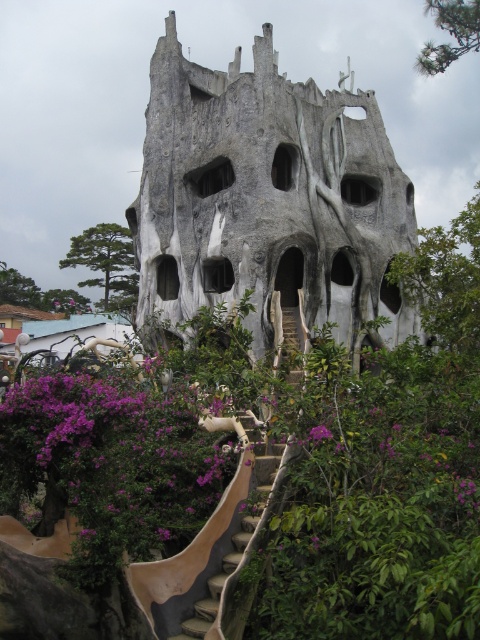
Can you confirm if purple matte flower at lower left is smaller than purple matte flower at center?

Incorrect, purple matte flower at lower left is not smaller in size than purple matte flower at center.

Between purple matte flower at lower left and purple matte flower at center, which one appears on the left side from the viewer's perspective?

purple matte flower at lower left is more to the left.

Who is more distant from viewer, (25, 438) or (310, 432)?

Positioned behind is point (310, 432).

Locate an element on the screen. purple matte flower at lower left is located at coordinates (109, 460).

Is the position of green leafy tree at center more distant than that of purple matte flower at center?

Yes.

Can you confirm if green leafy tree at center is smaller than purple matte flower at center?

Actually, green leafy tree at center might be larger than purple matte flower at center.

Is point (12, 301) in front of point (314, 426)?

No, it is behind (314, 426).

Locate an element on the screen. green leafy tree at center is located at coordinates (17, 289).

Does gray textured rock formation at center have a larger size compared to purple matte flower at center?

Yes.

Consider the image. Between gray textured rock formation at center and purple matte flower at center, which one is positioned higher?

gray textured rock formation at center

Image resolution: width=480 pixels, height=640 pixels. Describe the element at coordinates (268, 198) in the screenshot. I see `gray textured rock formation at center` at that location.

This screenshot has height=640, width=480. Identify the location of gray textured rock formation at center. (268, 198).